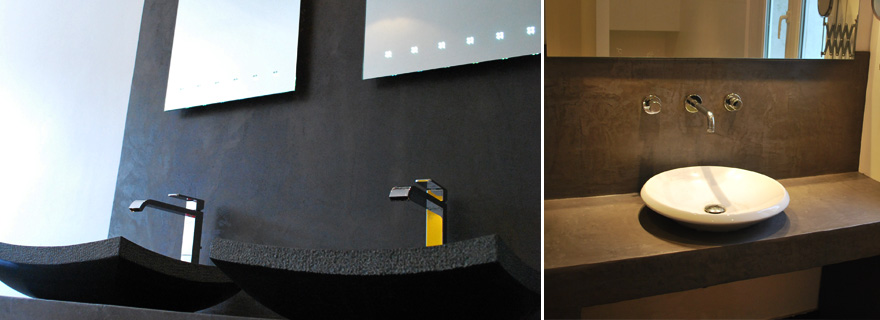
I want to click on faucet handles, so click(194, 201), click(436, 190), click(654, 103), click(734, 104).